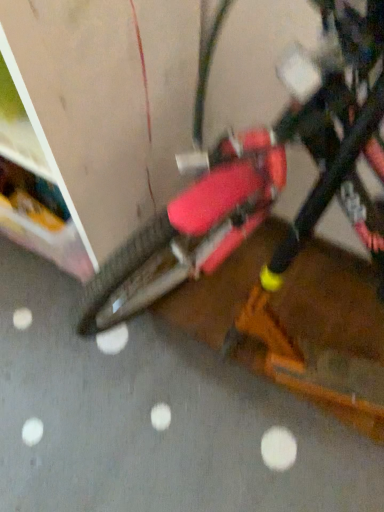
Question: Is matte orange scooter at center smaller than matte red bicycle at center?

Choices:
 (A) yes
 (B) no

Answer: (A)

Question: From a real-world perspective, is matte orange scooter at center over matte red bicycle at center?

Choices:
 (A) yes
 (B) no

Answer: (B)

Question: Is matte orange scooter at center not within matte red bicycle at center?

Choices:
 (A) no
 (B) yes

Answer: (B)

Question: Is matte orange scooter at center wider than matte red bicycle at center?

Choices:
 (A) no
 (B) yes

Answer: (B)

Question: Does matte orange scooter at center appear on the right side of matte red bicycle at center?

Choices:
 (A) no
 (B) yes

Answer: (A)

Question: Does matte orange scooter at center come in front of matte red bicycle at center?

Choices:
 (A) no
 (B) yes

Answer: (A)

Question: From a real-world perspective, is matte red bicycle at center physically above matte orange scooter at center?

Choices:
 (A) yes
 (B) no

Answer: (A)

Question: From the image's perspective, does matte red bicycle at center appear lower than matte orange scooter at center?

Choices:
 (A) yes
 (B) no

Answer: (B)

Question: Is matte red bicycle at center not inside matte orange scooter at center?

Choices:
 (A) yes
 (B) no

Answer: (A)

Question: Considering the relative sizes of matte red bicycle at center and matte orange scooter at center in the image provided, is matte red bicycle at center shorter than matte orange scooter at center?

Choices:
 (A) yes
 (B) no

Answer: (B)

Question: Is matte red bicycle at center at the right side of matte orange scooter at center?

Choices:
 (A) yes
 (B) no

Answer: (A)

Question: Does matte red bicycle at center have a smaller size compared to matte orange scooter at center?

Choices:
 (A) yes
 (B) no

Answer: (B)

Question: Is matte red bicycle at center in front of or behind matte orange scooter at center in the image?

Choices:
 (A) front
 (B) behind

Answer: (A)